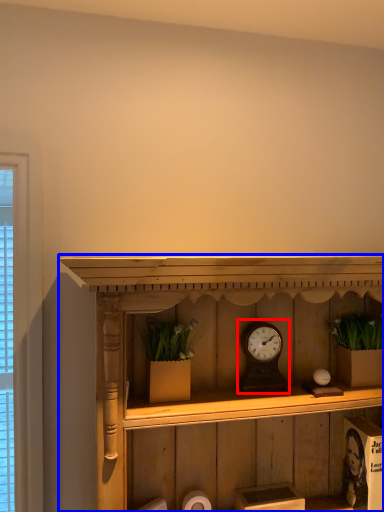
Question: Which object appears closest to the camera in this image, alarm clock (highlighted by a red box) or shelf (highlighted by a blue box)?

Choices:
 (A) alarm clock
 (B) shelf

Answer: (B)